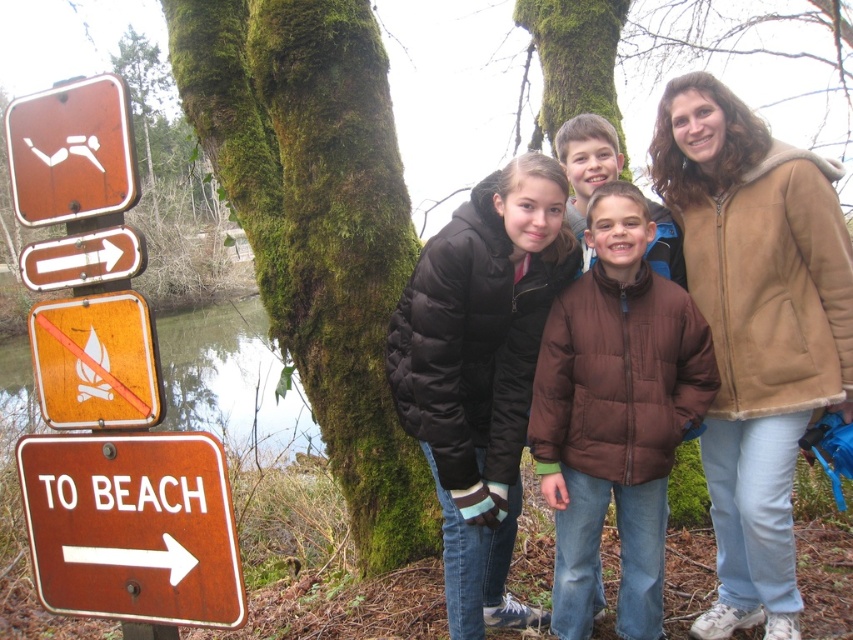
You are planning to take a hike and see the brown quilted jacket at upper right and the orange wood fire sign at left in the image. Which item is positioned higher in the image?

The brown quilted jacket at upper right is located above the orange wood fire sign at left, so it is positioned higher in the image.

You are planning to take a photo of the green mossy tree at center and the rusty metal sign at left. Since you want both objects to appear in the frame, which object should you focus on to ensure they are both in the shot?

The green mossy tree at center is much taller than the rusty metal sign at left, so you should focus on the green mossy tree at center to ensure both are in the frame.

You are trying to decide whether to wear the black puffy jacket at center for a hike. You notice the orange wood fire sign at left nearby. Which item is larger in size?

The black puffy jacket at center is bigger than the orange wood fire sign at left, so the jacket is larger in size.